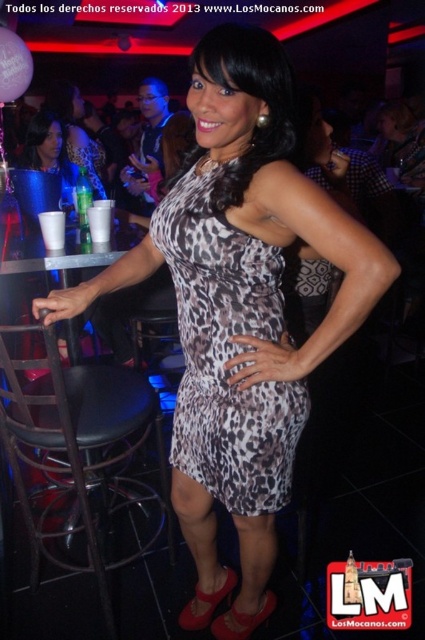
Question: Which object is closer to the camera taking this photo?

Choices:
 (A) matte black dress at upper left
 (B) leopard print dress at center

Answer: (B)

Question: Does leopard print dress at center come in front of matte black dress at upper left?

Choices:
 (A) no
 (B) yes

Answer: (B)

Question: Is leopard print dress at center bigger than matte black dress at upper left?

Choices:
 (A) no
 (B) yes

Answer: (A)

Question: Which point appears farthest from the camera in this image?

Choices:
 (A) (62, 124)
 (B) (197, 256)

Answer: (A)

Question: Can you confirm if leopard print dress at center is positioned to the right of matte black dress at upper left?

Choices:
 (A) yes
 (B) no

Answer: (A)